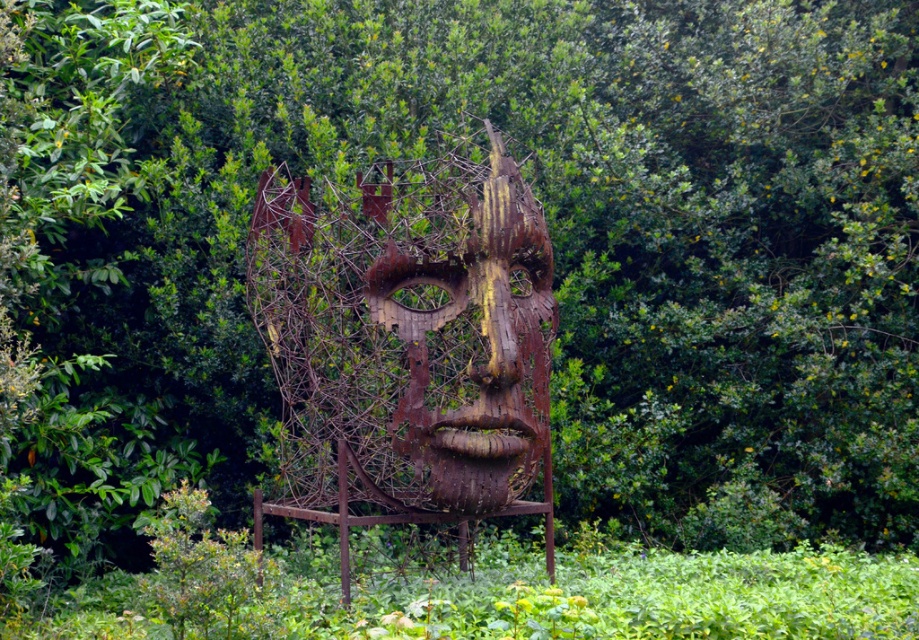
You are an art student analyzing the sculpture in the image. The sculpture is located at point (407, 340). Based on the coordinates provided, where is the sculpture positioned in the image?

The sculpture is positioned at the center of the image, as indicated by the point coordinates (407, 340).

You are a photographer trying to capture the rusty wire mesh face at center in your shot. Based on its position, where should you aim your camera to ensure it is centered in the frame?

The rusty wire mesh face at center is located at point (407, 340), so you should aim your camera at that coordinate to center it in the frame.